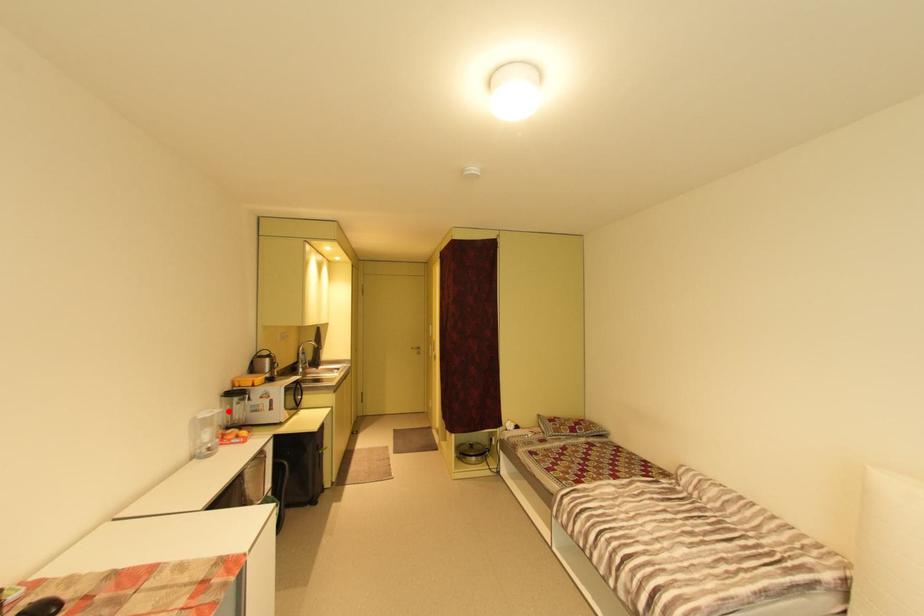
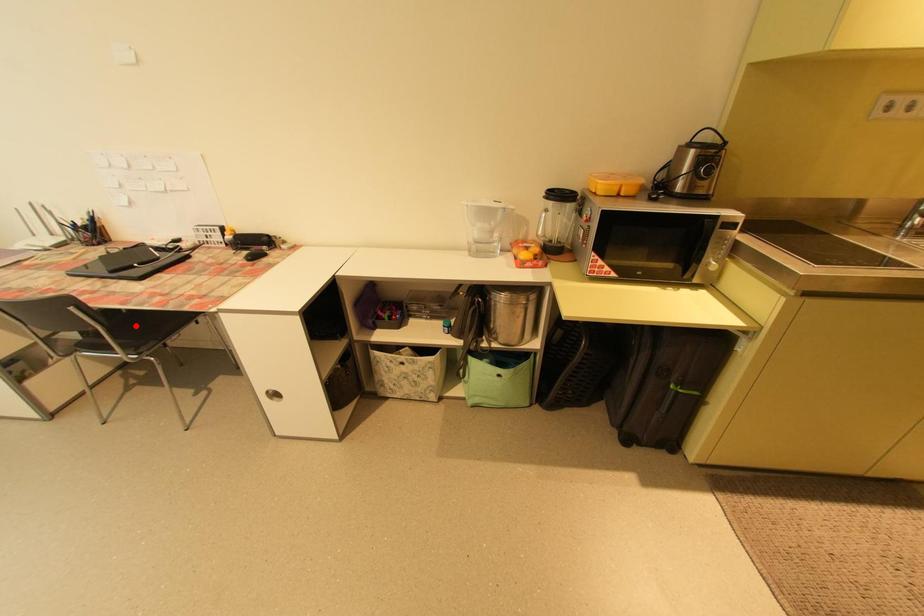
I am providing you with two images of the same scene from different viewpoints. A red point is marked on the first image and another point is marked on the second image. Do the highlighted points in image1 and image2 indicate the same real-world spot?

No